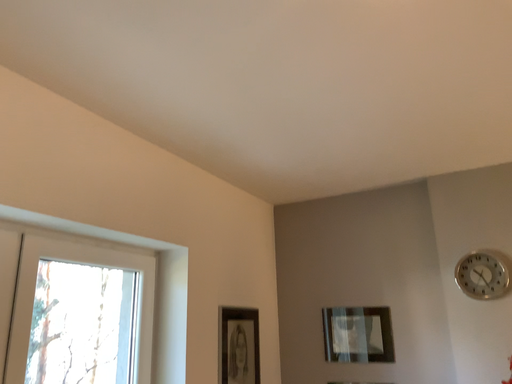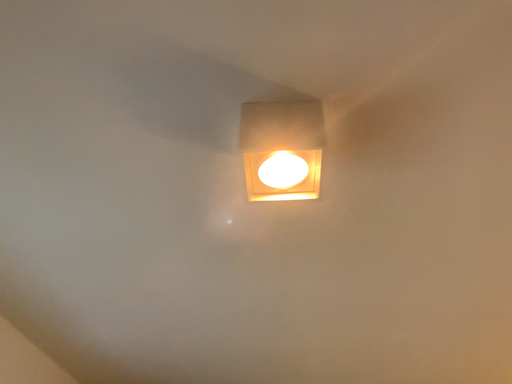
Question: How did the camera likely rotate when shooting the video?

Choices:
 (A) rotated upward
 (B) rotated downward

Answer: (A)